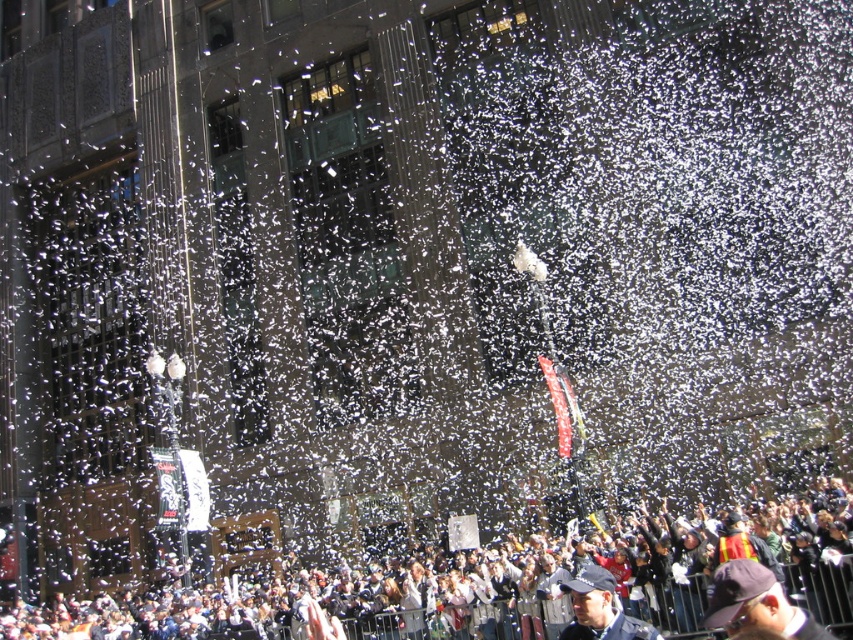
Based on the photo, who is taller, white paper confetti at lower center or blue fabric cap at lower center?

white paper confetti at lower center

Who is higher up, white paper confetti at lower center or blue fabric cap at lower center?

blue fabric cap at lower center is above.

Is point (711, 532) less distant than point (659, 637)?

No, it is behind (659, 637).

Locate an element on the screen. white paper confetti at lower center is located at coordinates (496, 582).

Does dark blue fabric cap at lower right lie in front of blue fabric cap at lower center?

Yes, dark blue fabric cap at lower right is closer to the viewer.

What do you see at coordinates (755, 604) in the screenshot?
I see `dark blue fabric cap at lower right` at bounding box center [755, 604].

The width and height of the screenshot is (853, 640). What are the coordinates of `dark blue fabric cap at lower right` in the screenshot? It's located at (755, 604).

Is white paper confetti at lower center smaller than dark blue fabric cap at lower right?

No.

Identify the location of white paper confetti at lower center. Image resolution: width=853 pixels, height=640 pixels. (496, 582).